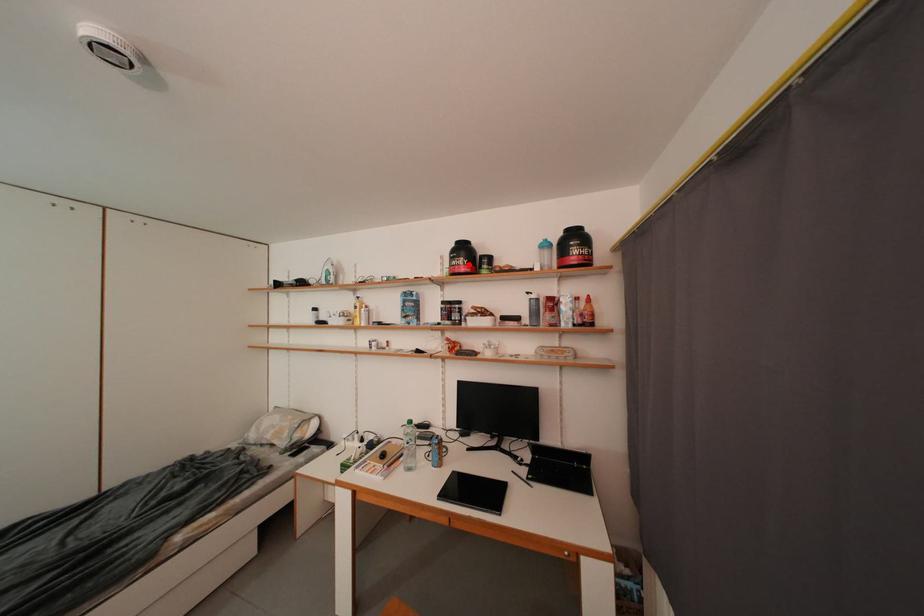
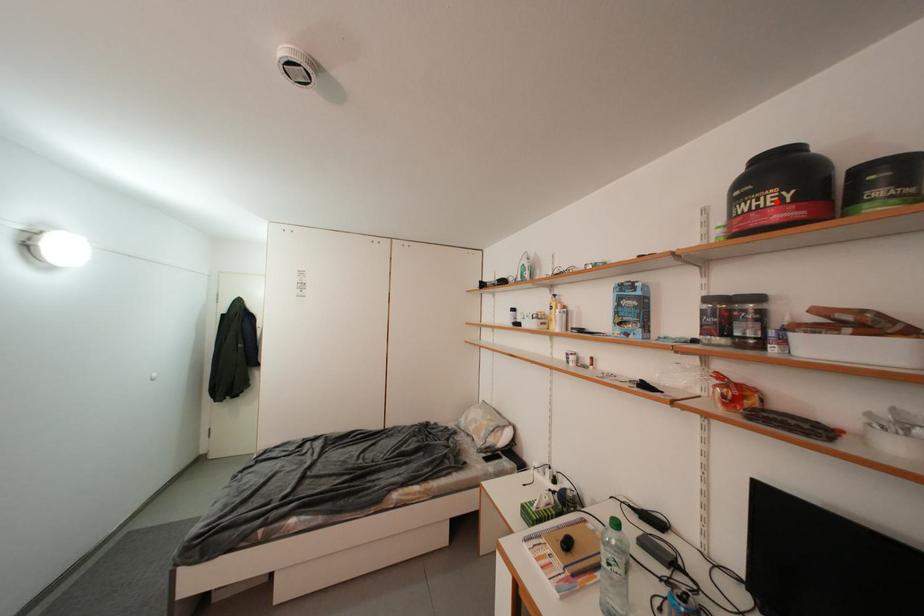
I am providing you with two images of the same scene from different viewpoints. A red point is marked on the first image and another point is marked on the second image. Is the marked point in image1 the same physical position as the marked point in image2?

Yes